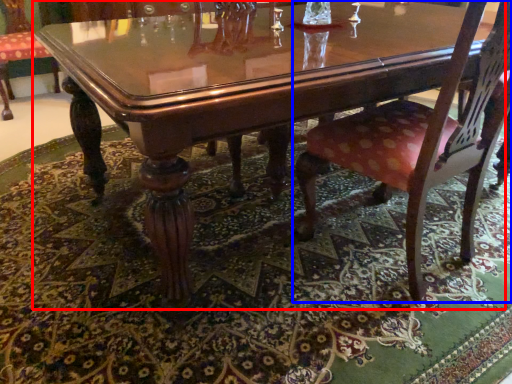
Question: Which point is further to the camera, coffee table (highlighted by a red box) or chair (highlighted by a blue box)?

Choices:
 (A) coffee table
 (B) chair

Answer: (B)